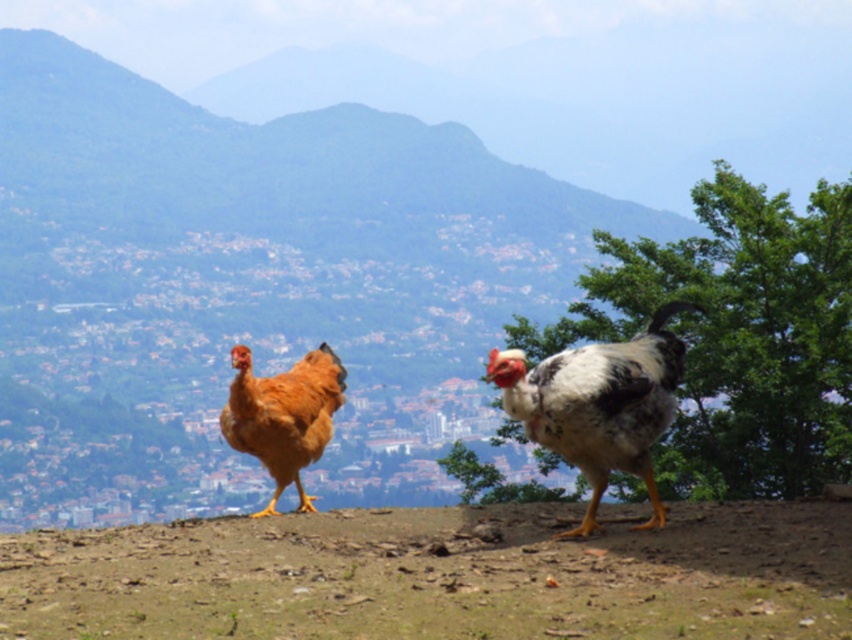
You are a farmer who just noticed a white speckled feather at center in the middle of the dirt patch where the chickens are standing. If you want to pick it up, which direction should you move relative to the chickens?

The white speckled feather at center is located at point (597, 404), so you should move towards the center of the dirt patch where the chickens are standing to pick it up.

You are standing in a rural area and want to place two markers at the specified coordinates. Which of the two points, point (586, 400) or point (280, 492), is closer to you?

Point (586, 400) is closer to the viewer than point (280, 492).